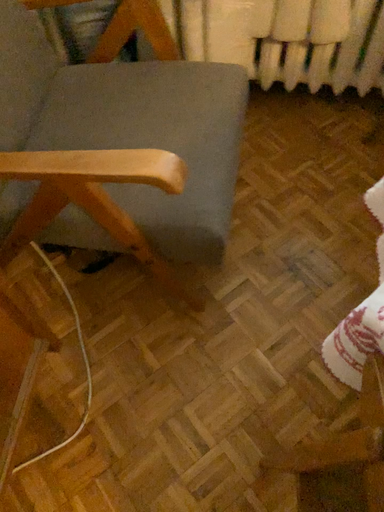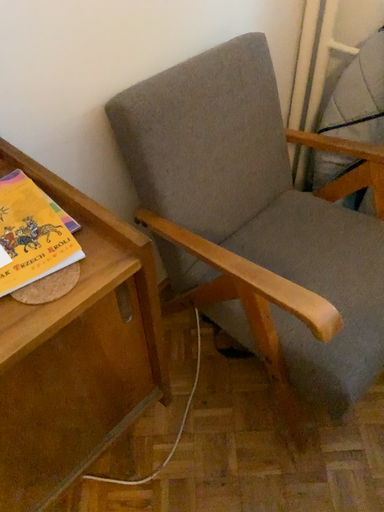
Question: How did the camera likely rotate when shooting the video?

Choices:
 (A) rotated left
 (B) rotated right

Answer: (A)